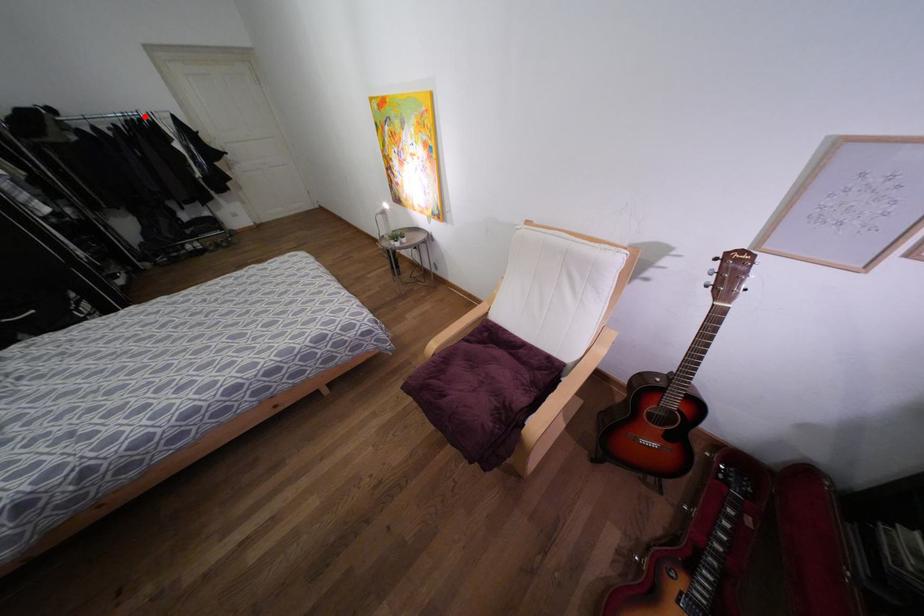
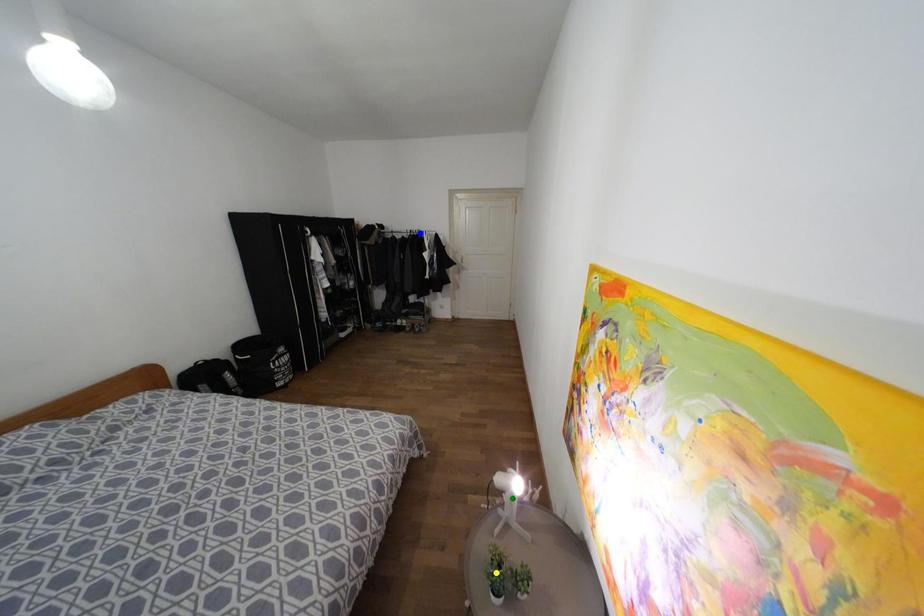
Question: I am providing you with two images of the same scene from different viewpoints. A red point is marked on the first image. You are given multiple points on the second image. Can you choose the point in image 2 that corresponds to the point in image 1?

Choices:
 (A) green point
 (B) yellow point
 (C) blue point

Answer: (C)